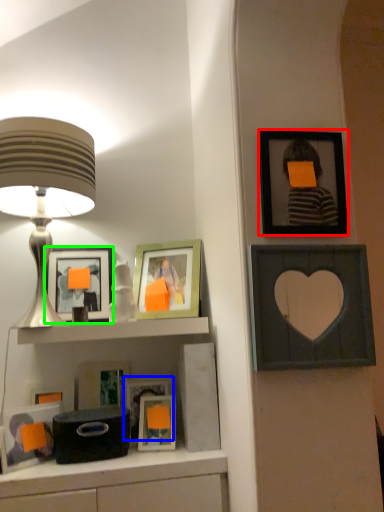
Question: Which is farther away from picture frame (highlighted by a red box)? picture frame (highlighted by a blue box) or picture frame (highlighted by a green box)?

Choices:
 (A) picture frame
 (B) picture frame

Answer: (A)